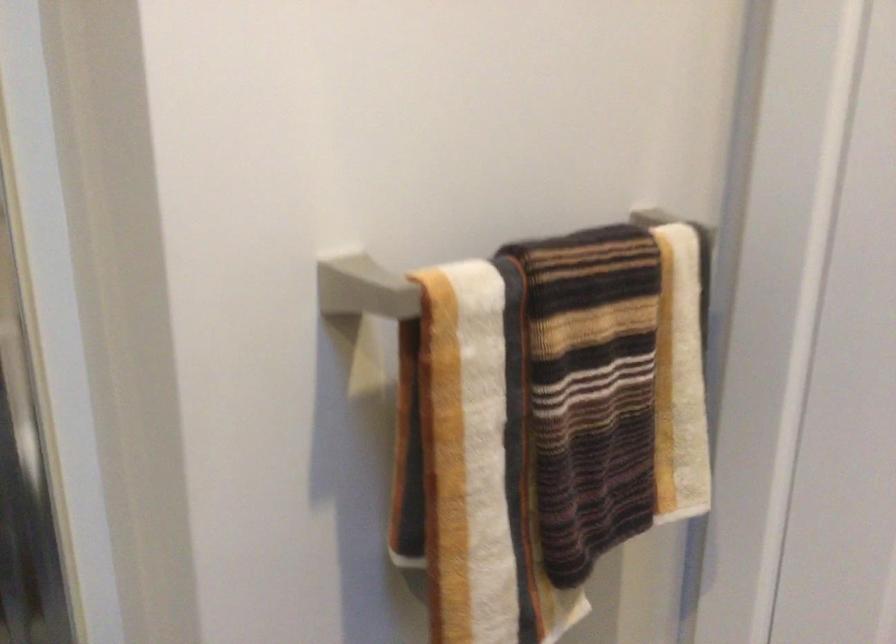
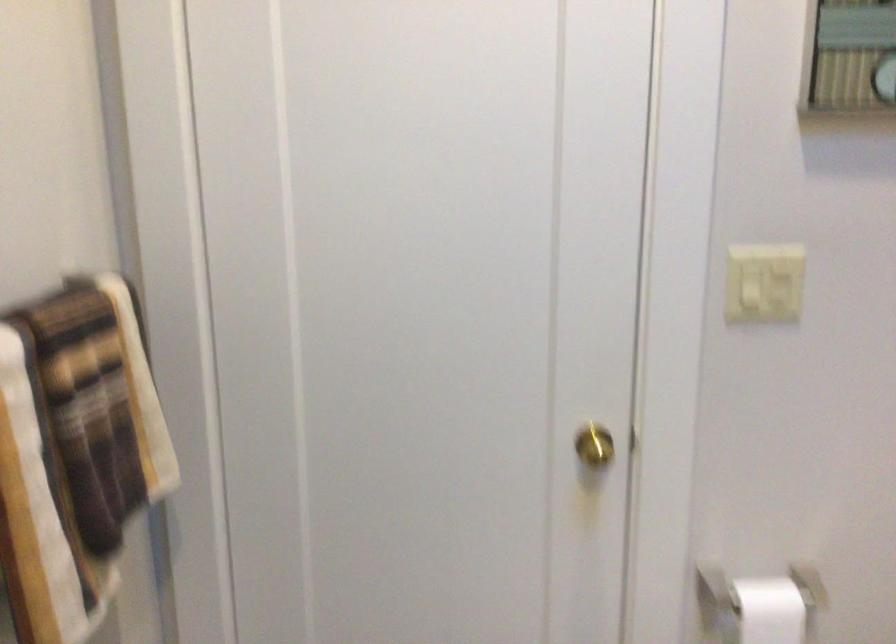
Question: Based on the continuous images, in which direction is the camera rotating? Reply with the corresponding letter.

Choices:
 (A) Left
 (B) Right
 (C) Up
 (D) Down

Answer: (B)